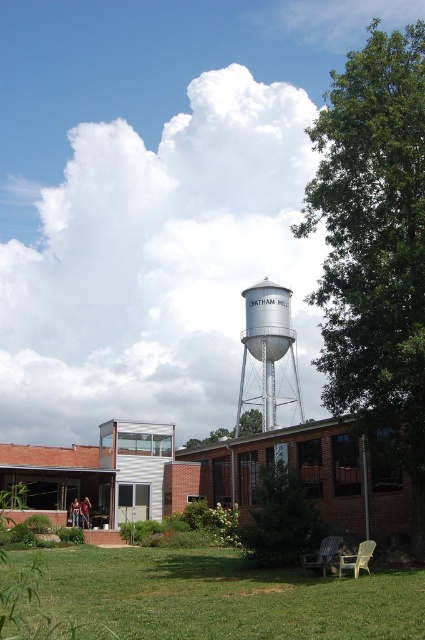
Question: Which object appears farthest from the camera in this image?

Choices:
 (A) silver metallic water tower at center
 (B) green grass at lower center

Answer: (A)

Question: Can you confirm if green grass at lower center is thinner than silver metallic water tower at center?

Choices:
 (A) no
 (B) yes

Answer: (A)

Question: In this image, where is green grass at lower center located relative to silver metallic water tower at center?

Choices:
 (A) left
 (B) right

Answer: (A)

Question: Is green grass at lower center closer to the viewer compared to silver metallic water tower at center?

Choices:
 (A) no
 (B) yes

Answer: (B)